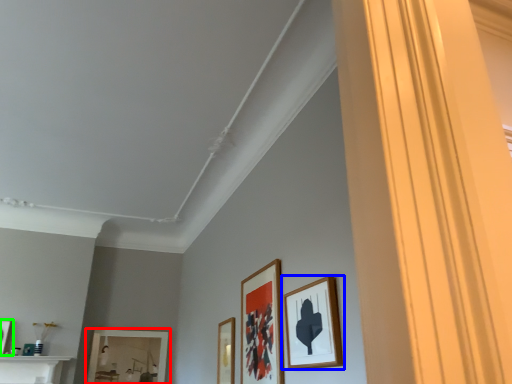
Question: Which is nearer to the picture frame (highlighted by a red box)? picture frame (highlighted by a blue box) or picture frame (highlighted by a green box).

Choices:
 (A) picture frame
 (B) picture frame

Answer: (B)